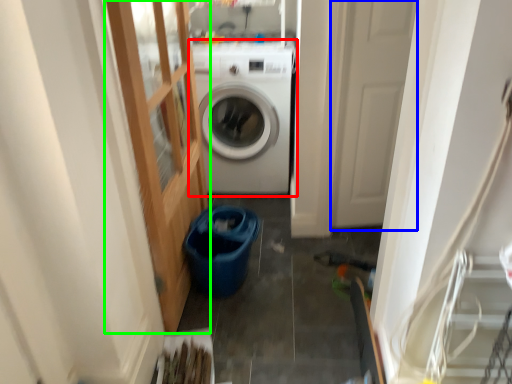
Question: Considering the real-world distances, which object is farthest from washing machine (highlighted by a red box)? screen door (highlighted by a blue box) or glass door (highlighted by a green box)?

Choices:
 (A) screen door
 (B) glass door

Answer: (A)